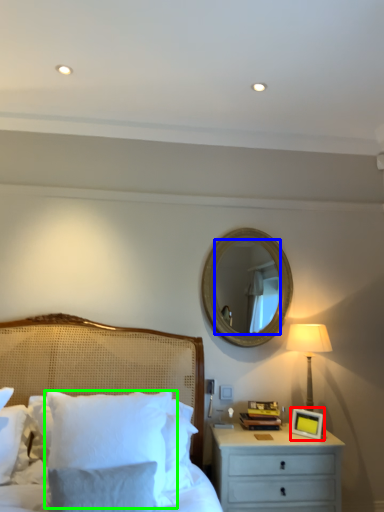
Question: Which is nearer to the picture frame (highlighted by a red box)? mirror (highlighted by a blue box) or pillow (highlighted by a green box).

Choices:
 (A) mirror
 (B) pillow

Answer: (B)